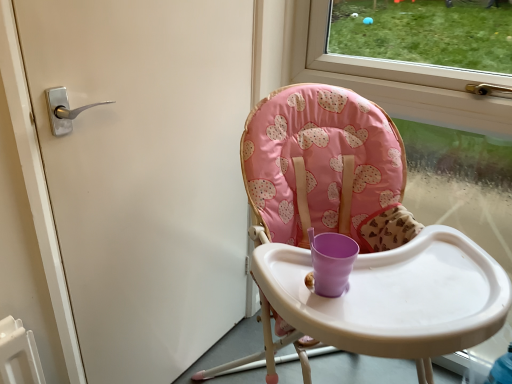
The image size is (512, 384). Describe the element at coordinates (145, 173) in the screenshot. I see `matte silver handle at left` at that location.

This screenshot has height=384, width=512. I want to click on matte silver handle at left, so click(145, 173).

What is the approximate height of matte silver handle at left?

matte silver handle at left is 3.85 feet in height.

The image size is (512, 384). What do you see at coordinates (325, 169) in the screenshot?
I see `pink fabric highchair at center` at bounding box center [325, 169].

Find the location of a particular element. The image size is (512, 384). pink fabric highchair at center is located at coordinates (325, 169).

Where is `matte silver handle at left`? The height and width of the screenshot is (384, 512). matte silver handle at left is located at coordinates (145, 173).

Between matte silver handle at left and pink fabric highchair at center, which one appears on the right side from the viewer's perspective?

pink fabric highchair at center.

Considering the relative positions of matte silver handle at left and pink fabric highchair at center in the image provided, is matte silver handle at left behind pink fabric highchair at center?

Yes.

Which point is more distant from viewer, (x=214, y=282) or (x=312, y=137)?

Positioned behind is point (x=214, y=282).

From the image's perspective, between matte silver handle at left and pink fabric highchair at center, who is located below?

pink fabric highchair at center, from the image's perspective.

From a real-world perspective, which object rests below the other?

In real-world perspective, pink fabric highchair at center is lower.

Does matte silver handle at left have a greater width compared to pink fabric highchair at center?

No, matte silver handle at left is not wider than pink fabric highchair at center.

Does matte silver handle at left have a lesser height compared to pink fabric highchair at center?

Incorrect, the height of matte silver handle at left does not fall short of that of pink fabric highchair at center.

Between matte silver handle at left and pink fabric highchair at center, which one has larger size?

pink fabric highchair at center is bigger.

Which is correct: matte silver handle at left is inside pink fabric highchair at center, or outside of it?

matte silver handle at left is not inside pink fabric highchair at center, it's outside.

Is matte silver handle at left in contact with pink fabric highchair at center?

matte silver handle at left and pink fabric highchair at center are not in contact.

Could you tell me if matte silver handle at left is facing pink fabric highchair at center?

Yes, matte silver handle at left is oriented towards pink fabric highchair at center.

How far apart are matte silver handle at left and pink fabric highchair at center?

A distance of 37.66 centimeters exists between matte silver handle at left and pink fabric highchair at center.

You are a GUI agent. You are given a task and a screenshot of the screen. Output one action in this format:
    pyautogui.click(x=<x>, y=<y>)
    Task: Click on the door above the pink fabric highchair at center (from a real-world perspective)
    The height and width of the screenshot is (384, 512).
    Given the screenshot: What is the action you would take?
    click(145, 173)

Between pink fabric highchair at center and matte silver handle at left, which one appears on the right side from the viewer's perspective?

From the viewer's perspective, pink fabric highchair at center appears more on the right side.

Relative to matte silver handle at left, is pink fabric highchair at center in front or behind?

Visually, pink fabric highchair at center is located in front of matte silver handle at left.

Considering the positions of points (349, 167) and (242, 215), is point (349, 167) farther from camera compared to point (242, 215)?

No, it is not.

From the image's perspective, is pink fabric highchair at center located beneath matte silver handle at left?

Yes, from the image's perspective, pink fabric highchair at center is beneath matte silver handle at left.

From a real-world perspective, is pink fabric highchair at center above or below matte silver handle at left?

pink fabric highchair at center is situated lower than matte silver handle at left in the real world.

Is pink fabric highchair at center wider than matte silver handle at left?

Yes.

Is pink fabric highchair at center taller than matte silver handle at left?

Incorrect, the height of pink fabric highchair at center is not larger of that of matte silver handle at left.

Looking at the image, does pink fabric highchair at center seem bigger or smaller compared to matte silver handle at left?

pink fabric highchair at center is bigger than matte silver handle at left.

Is pink fabric highchair at center surrounding matte silver handle at left?

Definitely not — matte silver handle at left is not inside pink fabric highchair at center.

Is pink fabric highchair at center positioned far away from matte silver handle at left?

That's not correct — pink fabric highchair at center is a little close to matte silver handle at left.

Is pink fabric highchair at center facing away from matte silver handle at left?

pink fabric highchair at center does not have its back to matte silver handle at left.

Can you tell me how much pink fabric highchair at center and matte silver handle at left differ in facing direction?

The angular difference between pink fabric highchair at center and matte silver handle at left is 41.9 degrees.

In the image, there is a matte silver handle at left. Where is `chair below it (from a real-world perspective)`? The width and height of the screenshot is (512, 384). chair below it (from a real-world perspective) is located at coordinates (325, 169).

In the image, there is a matte silver handle at left. Identify the location of chair below it (from a real-world perspective). (325, 169).

The width and height of the screenshot is (512, 384). In order to click on chair on the right of matte silver handle at left in this screenshot , I will do `click(325, 169)`.